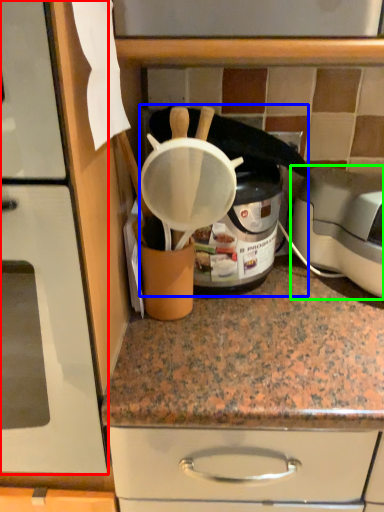
Question: Which is nearer to the home appliance (highlighted by a red box)? appliance (highlighted by a blue box) or toaster (highlighted by a green box).

Choices:
 (A) appliance
 (B) toaster

Answer: (A)